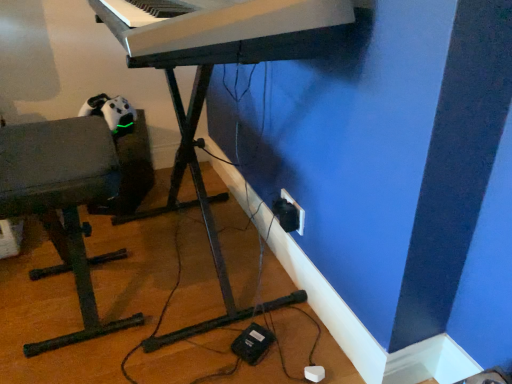
What do you see at coordinates (63, 203) in the screenshot?
I see `matte gray bench at left` at bounding box center [63, 203].

Describe the element at coordinates (297, 208) in the screenshot. I see `black plastic electric outlet at lower right` at that location.

What is the approximate width of white plastic keyboard at upper center?

17.10 inches.

Find the location of a particular element. The height and width of the screenshot is (384, 512). white plastic keyboard at upper center is located at coordinates point(225,30).

The height and width of the screenshot is (384, 512). Describe the element at coordinates (210, 76) in the screenshot. I see `white plastic piano at center` at that location.

The width and height of the screenshot is (512, 384). Find the location of `black plastic plug at lower right`. black plastic plug at lower right is located at coordinates (286, 215).

From a real-world perspective, is black plastic electric outlet at lower right above or below black plastic plug at lower right?

black plastic electric outlet at lower right is below black plastic plug at lower right.

How much distance is there between black plastic electric outlet at lower right and black plastic plug at lower right?

1.09 inches.

Could you tell me if black plastic electric outlet at lower right is turned towards black plastic plug at lower right?

Yes, black plastic electric outlet at lower right is facing black plastic plug at lower right.

Based on the photo, from the image's perspective, is black plastic electric outlet at lower right located above or below black plastic plug at lower right?

black plastic electric outlet at lower right is situated higher than black plastic plug at lower right in the image.

The width and height of the screenshot is (512, 384). Identify the location of furniture that appears on the left of black plastic electric outlet at lower right. (63, 203).

Between point (301, 215) and point (86, 142), which one is positioned in front?

Point (86, 142)

Does black plastic electric outlet at lower right have a larger size compared to matte gray bench at left?

Actually, black plastic electric outlet at lower right might be smaller than matte gray bench at left.

Considering the relative sizes of white plastic piano at center and black plastic electric outlet at lower right in the image provided, is white plastic piano at center taller than black plastic electric outlet at lower right?

Correct, white plastic piano at center is much taller as black plastic electric outlet at lower right.

Which object is more forward, white plastic piano at center or black plastic electric outlet at lower right?

white plastic piano at center.

Looking at the image, does white plastic piano at center seem bigger or smaller compared to black plastic electric outlet at lower right?

white plastic piano at center is bigger than black plastic electric outlet at lower right.

This screenshot has height=384, width=512. Identify the location of electric outlet that is on the right side of white plastic piano at center. (297, 208).

Is black plastic electric outlet at lower right oriented towards white plastic keyboard at upper center?

No, black plastic electric outlet at lower right is not oriented towards white plastic keyboard at upper center.

Are black plastic electric outlet at lower right and white plastic keyboard at upper center beside each other?

black plastic electric outlet at lower right and white plastic keyboard at upper center are not in contact.

In the scene shown: Which of these two, black plastic electric outlet at lower right or white plastic keyboard at upper center, stands taller?

black plastic electric outlet at lower right.

From the image's perspective, which one is positioned lower, black plastic electric outlet at lower right or white plastic keyboard at upper center?

black plastic electric outlet at lower right, from the image's perspective.

Who is shorter, white plastic keyboard at upper center or white plastic piano at center?

white plastic keyboard at upper center is shorter.

Consider the image. From a real-world perspective, is white plastic keyboard at upper center beneath white plastic piano at center?

No.

Can you tell me how much white plastic keyboard at upper center and white plastic piano at center differ in facing direction?

The facing directions of white plastic keyboard at upper center and white plastic piano at center are 3.15 degrees apart.

Considering the points (73, 135) and (303, 226), which point is behind, point (73, 135) or point (303, 226)?

The point (303, 226) is farther from the camera.

From a real-world perspective, between matte gray bench at left and black plastic electric outlet at lower right, who is vertically higher?

In real-world perspective, matte gray bench at left is above.

Is matte gray bench at left shorter than black plastic electric outlet at lower right?

In fact, matte gray bench at left may be taller than black plastic electric outlet at lower right.

Considering the sizes of objects matte gray bench at left and black plastic electric outlet at lower right in the image provided, who is smaller, matte gray bench at left or black plastic electric outlet at lower right?

black plastic electric outlet at lower right is smaller.

From the image's perspective, is white plastic keyboard at upper center under black plastic electric outlet at lower right?

No.

Based on their positions, is white plastic keyboard at upper center located to the left or right of black plastic electric outlet at lower right?

white plastic keyboard at upper center is positioned on black plastic electric outlet at lower right's left side.

Considering the positions of point (313, 36) and point (281, 192), is point (313, 36) closer or farther from the camera than point (281, 192)?

Point (313, 36).

Identify the location of plug to the left of black plastic electric outlet at lower right. pos(286,215).

The height and width of the screenshot is (384, 512). I want to click on electric outlet behind the matte gray bench at left, so click(297, 208).

Looking at the image, which one is located further to black plastic electric outlet at lower right, black plastic plug at lower right or matte gray bench at left?

Based on the image, matte gray bench at left appears to be further to black plastic electric outlet at lower right.

Which object lies nearer to the anchor point matte gray bench at left, black plastic plug at lower right or black plastic electric outlet at lower right?

Among the two, black plastic plug at lower right is located nearer to matte gray bench at left.

Which object lies further to the anchor point white plastic keyboard at upper center, white plastic piano at center or matte gray bench at left?

matte gray bench at left.

Which object lies nearer to the anchor point white plastic keyboard at upper center, black plastic electric outlet at lower right or matte gray bench at left?

Based on the image, matte gray bench at left appears to be nearer to white plastic keyboard at upper center.

Estimate the real-world distances between objects in this image. Which object is closer to white plastic piano at center, black plastic electric outlet at lower right or black plastic plug at lower right?

Based on the image, black plastic plug at lower right appears to be nearer to white plastic piano at center.

Estimate the real-world distances between objects in this image. Which object is closer to matte gray bench at left, white plastic piano at center or black plastic plug at lower right?

The object closer to matte gray bench at left is white plastic piano at center.

Looking at the image, which one is located further to black plastic electric outlet at lower right, matte gray bench at left or black plastic plug at lower right?

Based on the image, matte gray bench at left appears to be further to black plastic electric outlet at lower right.

From the image, which object appears to be nearer to matte gray bench at left, white plastic keyboard at upper center or black plastic plug at lower right?

Based on the image, white plastic keyboard at upper center appears to be nearer to matte gray bench at left.

The image size is (512, 384). In order to click on plug between white plastic piano at center and black plastic electric outlet at lower right from front to back in this screenshot , I will do `click(286, 215)`.

The height and width of the screenshot is (384, 512). What are the coordinates of `piano between white plastic keyboard at upper center and matte gray bench at left in the vertical direction` in the screenshot? It's located at [210, 76].

Find the location of a particular element. Image resolution: width=512 pixels, height=384 pixels. plug positioned between white plastic keyboard at upper center and black plastic electric outlet at lower right from near to far is located at coordinates (286, 215).

This screenshot has width=512, height=384. What are the coordinates of `electric outlet between white plastic keyboard at upper center and matte gray bench at left in the vertical direction` in the screenshot? It's located at (297, 208).